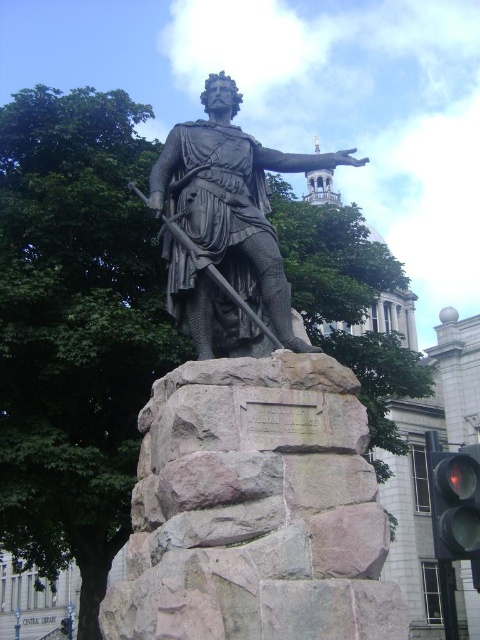
Question: Can you confirm if bronze statue at center is wider than red glass traffic light at lower right?

Choices:
 (A) no
 (B) yes

Answer: (B)

Question: Is bronze statue at center bigger than red glass traffic light at lower right?

Choices:
 (A) no
 (B) yes

Answer: (B)

Question: Which of the following is the farthest from the observer?

Choices:
 (A) bronze statue at center
 (B) polished bronze statue at center
 (C) red glass traffic light at lower right

Answer: (C)

Question: Does polished bronze statue at center have a smaller size compared to red glass traffic light at lower right?

Choices:
 (A) no
 (B) yes

Answer: (A)

Question: Among these objects, which one is farthest from the camera?

Choices:
 (A) bronze statue at center
 (B) red glass traffic light at lower right

Answer: (B)

Question: Estimate the real-world distances between objects in this image. Which object is closer to the red glass traffic light at lower right?

Choices:
 (A) polished bronze statue at center
 (B) bronze statue at center

Answer: (A)